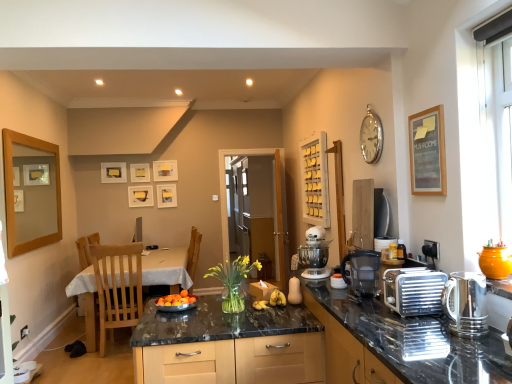
Question: Considering the relative sizes of white glossy table at lower left and black plastic water filter at center, which appears as the 2th kitchen appliance when viewed from the right, in the image provided, is white glossy table at lower left wider than black plastic water filter at center, which appears as the 2th kitchen appliance when viewed from the right,?

Choices:
 (A) yes
 (B) no

Answer: (A)

Question: Is white glossy table at lower left smaller than black plastic water filter at center, placed as the first kitchen appliance when sorted from left to right?

Choices:
 (A) yes
 (B) no

Answer: (B)

Question: Does white glossy table at lower left appear on the right side of black plastic water filter at center, the second kitchen appliance positioned from the front?

Choices:
 (A) no
 (B) yes

Answer: (A)

Question: Is white glossy table at lower left shorter than black plastic water filter at center, which appears as the 2th kitchen appliance when viewed from the right?

Choices:
 (A) yes
 (B) no

Answer: (B)

Question: Would you say black plastic water filter at center, acting as the 1th kitchen appliance starting from the back, is part of white glossy table at lower left's contents?

Choices:
 (A) no
 (B) yes

Answer: (A)

Question: Considering the positions of point (365, 274) and point (14, 140), is point (365, 274) closer or farther from the camera than point (14, 140)?

Choices:
 (A) farther
 (B) closer

Answer: (B)

Question: Is black plastic water filter at center, placed as the first kitchen appliance when sorted from left to right, bigger or smaller than wooden picture frame at left, positioned as the 6th picture frame in back-to-front order?

Choices:
 (A) big
 (B) small

Answer: (B)

Question: From a real-world perspective, relative to wooden picture frame at left, which ranks as the seventh picture frame in right-to-left order, is black plastic water filter at center, which appears as the 2th kitchen appliance when viewed from the right, vertically above or below?

Choices:
 (A) below
 (B) above

Answer: (A)

Question: From the image's perspective, is black plastic water filter at center, placed as the first kitchen appliance when sorted from left to right, positioned above or below wooden picture frame at left, the second picture frame from the front?

Choices:
 (A) above
 (B) below

Answer: (B)

Question: Is transparent glass door at center wider or thinner than shiny granite countertop at center?

Choices:
 (A) thin
 (B) wide

Answer: (A)

Question: Relative to shiny granite countertop at center, is transparent glass door at center in front or behind?

Choices:
 (A) behind
 (B) front

Answer: (A)

Question: In terms of size, does transparent glass door at center appear bigger or smaller than shiny granite countertop at center?

Choices:
 (A) big
 (B) small

Answer: (B)

Question: In the image, is transparent glass door at center on the left side or the right side of shiny granite countertop at center?

Choices:
 (A) right
 (B) left

Answer: (B)

Question: Based on their sizes in the image, would you say white glossy table at lower left is bigger or smaller than silver metallic clock at upper right?

Choices:
 (A) small
 (B) big

Answer: (B)

Question: Considering their positions, is white glossy table at lower left located in front of or behind silver metallic clock at upper right?

Choices:
 (A) behind
 (B) front

Answer: (A)